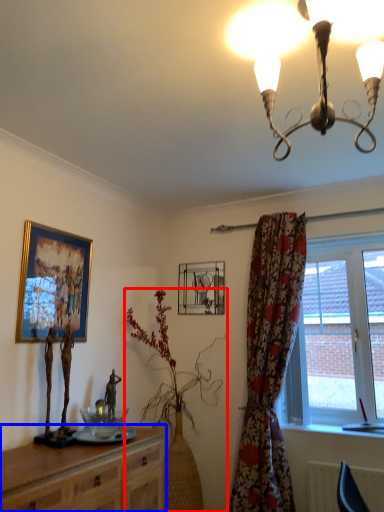
Question: Which point is closer to the camera, houseplant (highlighted by a red box) or cabinetry (highlighted by a blue box)?

Choices:
 (A) houseplant
 (B) cabinetry

Answer: (B)